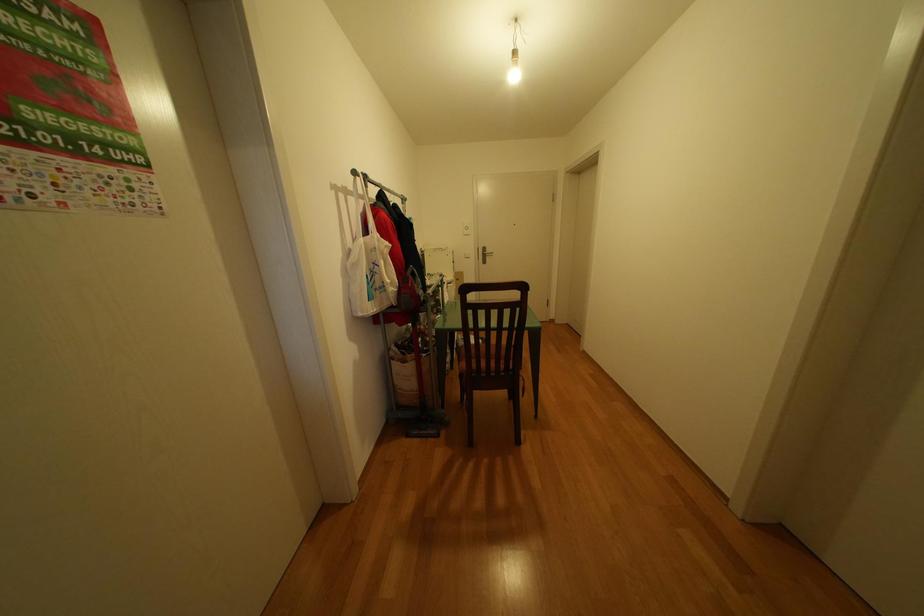
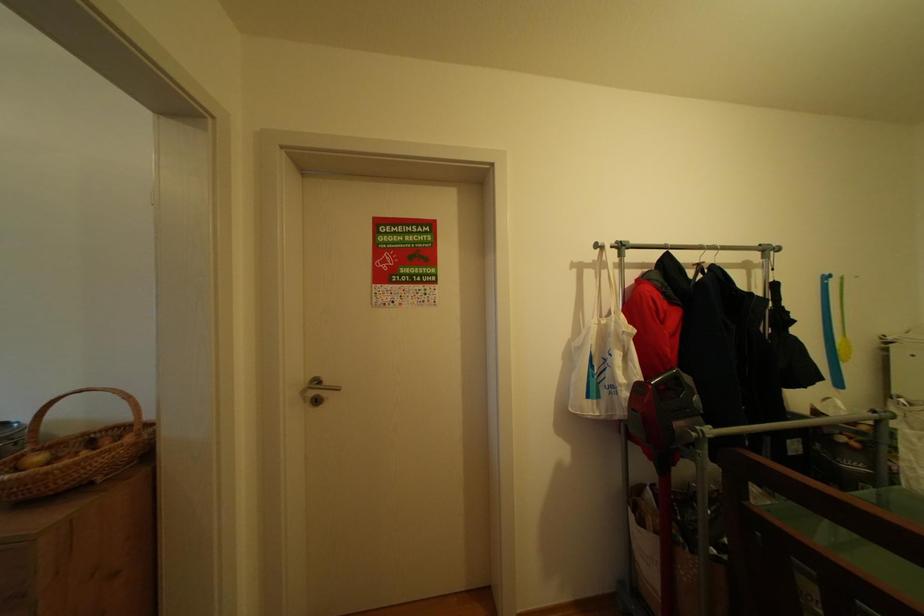
Question: The images are taken continuously from a first-person perspective. In which direction is your viewpoint rotating?

Choices:
 (A) Left
 (B) Right
 (C) Up
 (D) Down

Answer: (A)